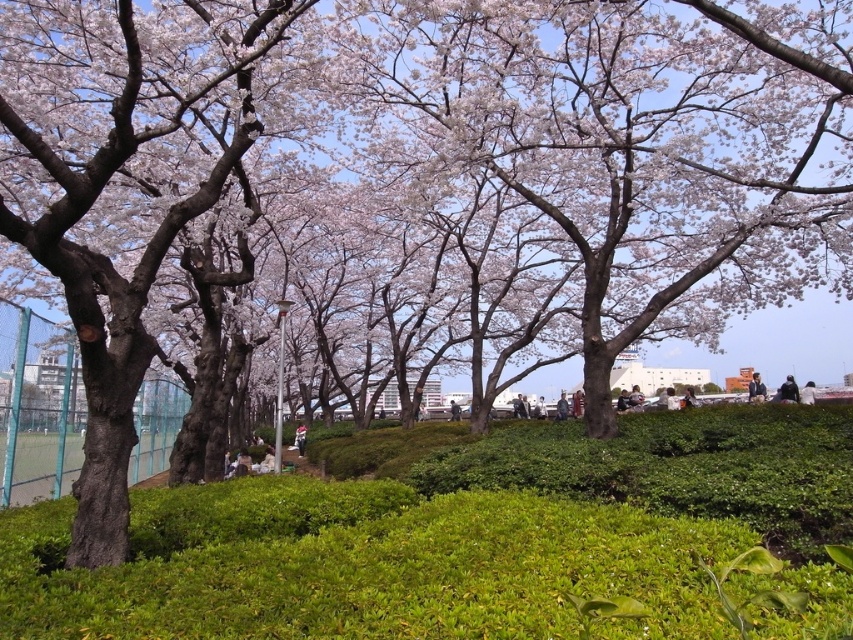
Question: Does green leafy shrubs at center have a smaller size compared to white cotton shirt at center?

Choices:
 (A) yes
 (B) no

Answer: (A)

Question: Which object appears closest to the camera in this image?

Choices:
 (A) dark blue jacket at center
 (B) dark gray fabric jacket at upper right
 (C) green leafy shrubs at center

Answer: (C)

Question: Observing the image, what is the correct spatial positioning of green leafy shrubs at center in reference to dark blue jacket at center?

Choices:
 (A) left
 (B) right

Answer: (A)

Question: Estimate the real-world distances between objects in this image. Which object is closer to the green leafy shrubs at center?

Choices:
 (A) dark blue jacket at center
 (B) dark gray fabric jacket at upper right
 (C) white cotton shirt at center

Answer: (B)

Question: Which of the following is the farthest from the observer?

Choices:
 (A) (305, 428)
 (B) (184, 492)
 (C) (782, 385)
 (D) (758, 376)

Answer: (A)

Question: Does green leafy shrubs at center have a lesser width compared to dark blue jacket at center?

Choices:
 (A) yes
 (B) no

Answer: (A)